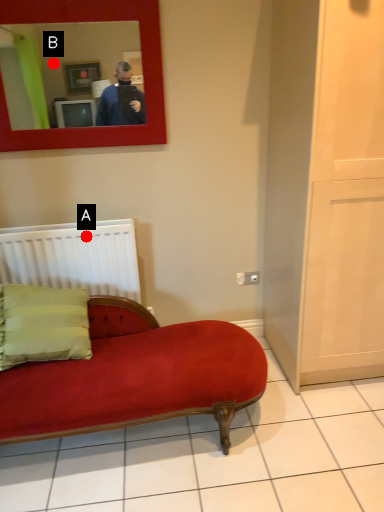
Question: Two points are circled on the image, labeled by A and B beside each circle. Among these points, which one is farthest from the camera?

Choices:
 (A) A is further
 (B) B is further

Answer: (A)